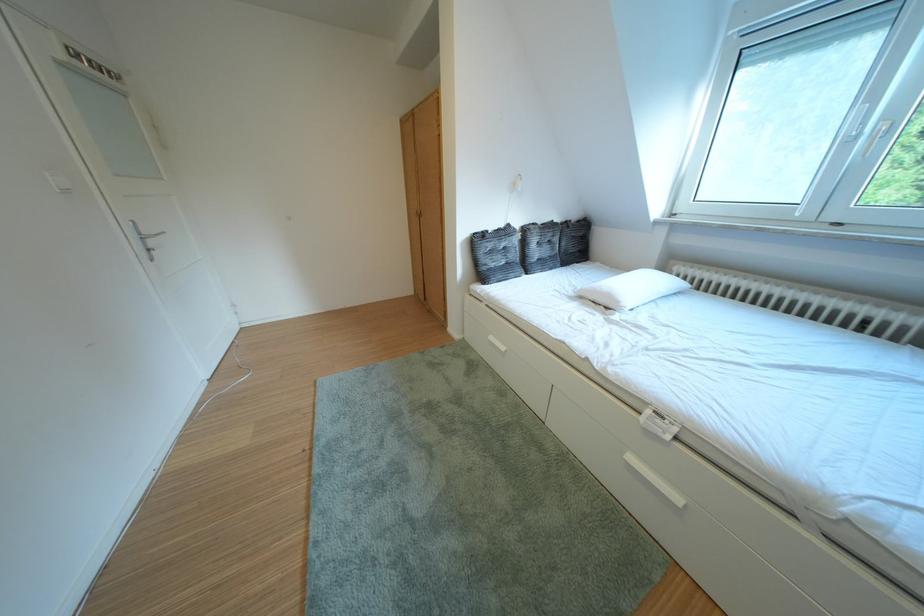
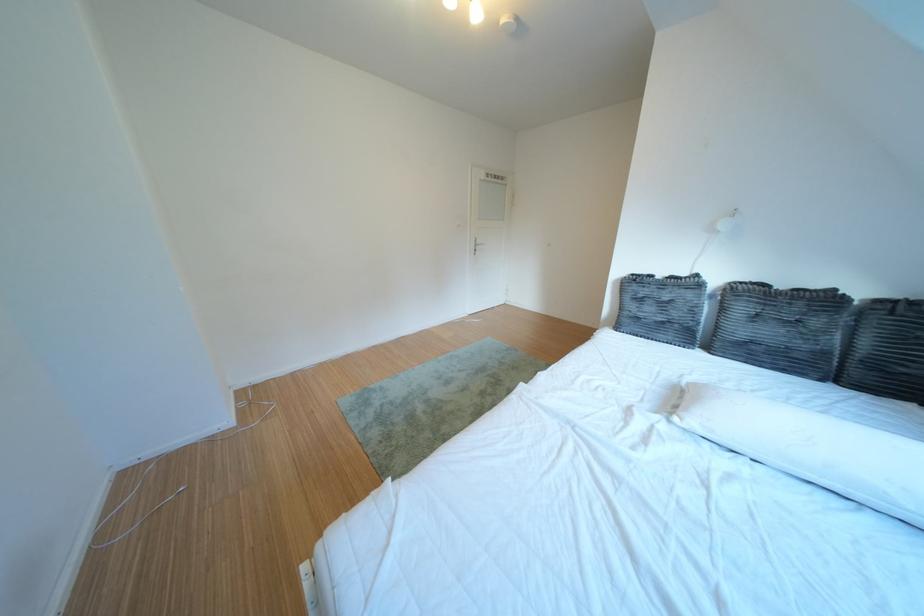
Where in the second image is the point corresponding to pixel 579 227 from the first image?

(910, 306)